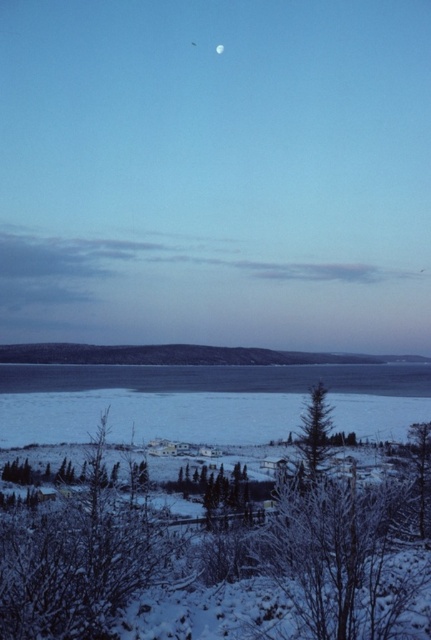
Question: Is frosty bark tree at lower left wider than green matte tree at center?

Choices:
 (A) no
 (B) yes

Answer: (B)

Question: Does frosty bark tree at lower left have a greater width compared to silvery reflective moon at upper center?

Choices:
 (A) yes
 (B) no

Answer: (A)

Question: Which object appears farthest from the camera in this image?

Choices:
 (A) green matte tree at center
 (B) frosty bark tree at lower left
 (C) silvery reflective moon at upper center
 (D) white ice at lower center

Answer: (C)

Question: Is the position of white ice at lower center less distant than that of silvery reflective moon at upper center?

Choices:
 (A) yes
 (B) no

Answer: (A)

Question: Which object is the closest to the green matte tree at center?

Choices:
 (A) silvery reflective moon at upper center
 (B) white ice at lower center
 (C) frosty bark tree at lower left

Answer: (C)

Question: Which point is closer to the camera?

Choices:
 (A) (218, 48)
 (B) (209, 422)

Answer: (B)